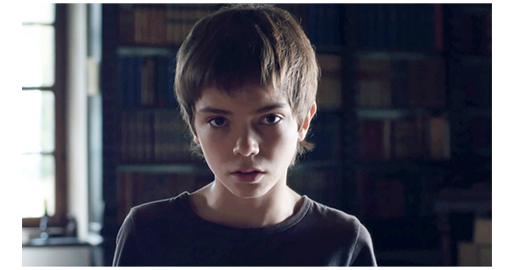
Identify the location of rows of books. This screenshot has height=270, width=514. click(136, 84), click(165, 135), click(156, 32), click(145, 187), click(375, 149), click(378, 89), click(378, 47), click(378, 196).